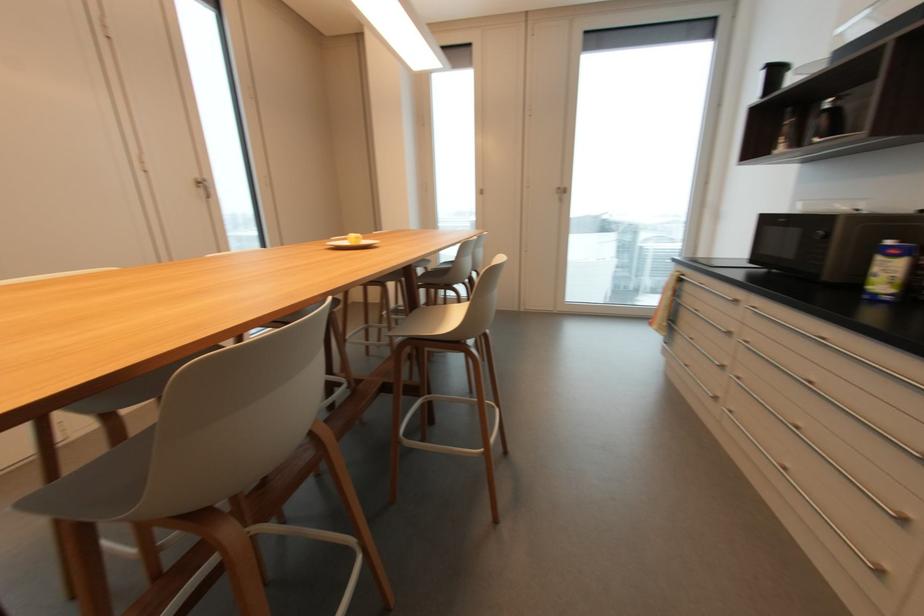
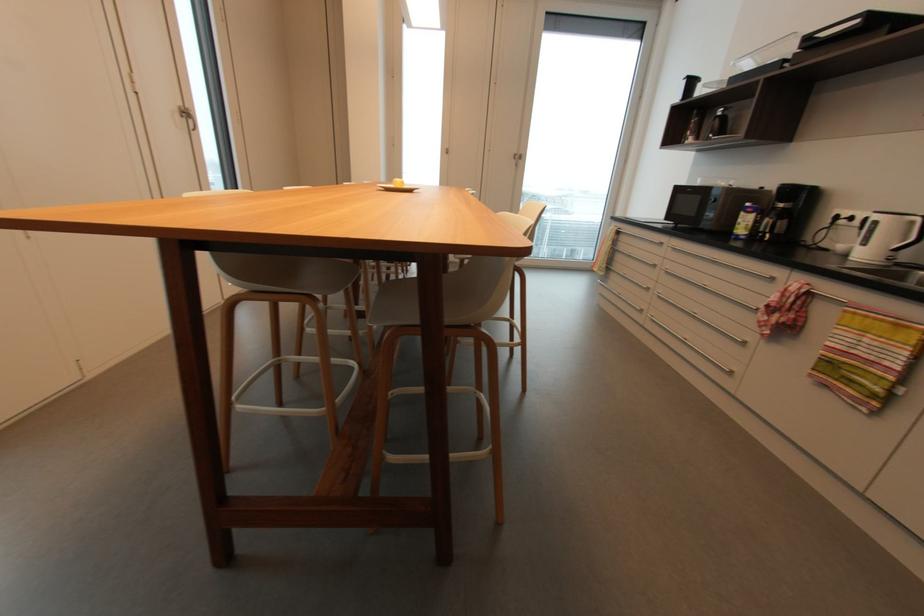
Where in the second image is the point corresponding to [895,243] from the first image?

(750, 205)